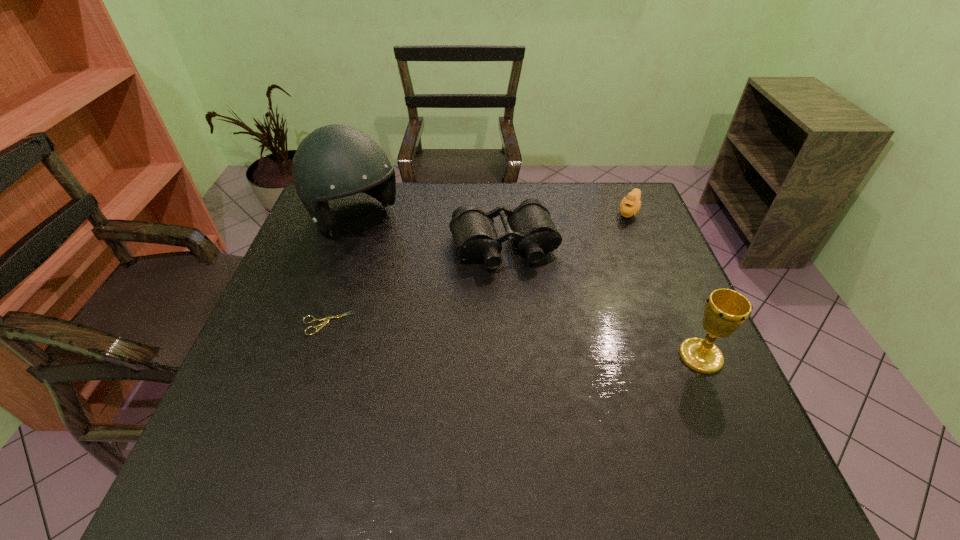
Where is `free spot between the tallest object and the shears`? free spot between the tallest object and the shears is located at coordinates (341, 271).

Find the location of a particular element. This screenshot has width=960, height=540. vacant space that is in between the binoculars and the duckling is located at coordinates (566, 229).

Locate which object ranks second in proximity to the duckling. Please provide its 2D coordinates. Your answer should be formatted as a tuple, i.e. [(x, y)], where the tuple contains the x and y coordinates of a point satisfying the conditions above.

[(726, 310)]

Select which object appears as the second closest to the duckling. Please provide its 2D coordinates. Your answer should be formatted as a tuple, i.e. [(x, y)], where the tuple contains the x and y coordinates of a point satisfying the conditions above.

[(726, 310)]

Locate an element on the screen. The height and width of the screenshot is (540, 960). free space in the image that satisfies the following two spatial constraints: 1. on the back side of the duckling; 2. on the right side of the third object from right to left is located at coordinates (502, 212).

Locate an element on the screen. Image resolution: width=960 pixels, height=540 pixels. free space that satisfies the following two spatial constraints: 1. on the back side of the duckling; 2. on the left side of the binoculars is located at coordinates tap(502, 212).

Locate an element on the screen. The image size is (960, 540). free spot that satisfies the following two spatial constraints: 1. on the back side of the shears; 2. on the left side of the third object from left to right is located at coordinates (352, 246).